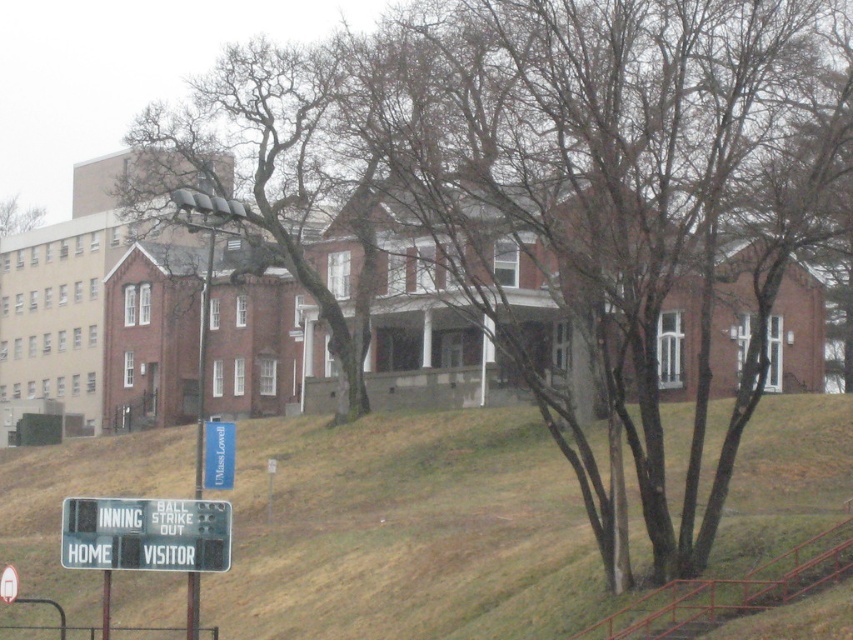
Question: Based on their relative distances, which object is farther from the green grass at lower center?

Choices:
 (A) white plastic scoreboard at lower left
 (B) bare branches at upper left

Answer: (B)

Question: Estimate the real-world distances between objects in this image. Which object is closer to the bare branches at upper left?

Choices:
 (A) blue fabric sign at lower left
 (B) green grass at lower center
 (C) white plastic scoreboard at lower left

Answer: (B)

Question: Where is green grass at lower center located in relation to bare branches at upper left in the image?

Choices:
 (A) right
 (B) left

Answer: (A)

Question: Which of the following is the closest to the observer?

Choices:
 (A) white plastic scoreboard at lower left
 (B) blue fabric sign at lower left

Answer: (A)

Question: Can you confirm if blue fabric sign at lower left is wider than bare branches at upper left?

Choices:
 (A) yes
 (B) no

Answer: (B)

Question: Is green grass at lower center positioned at the back of white plastic scoreboard at lower left?

Choices:
 (A) yes
 (B) no

Answer: (B)